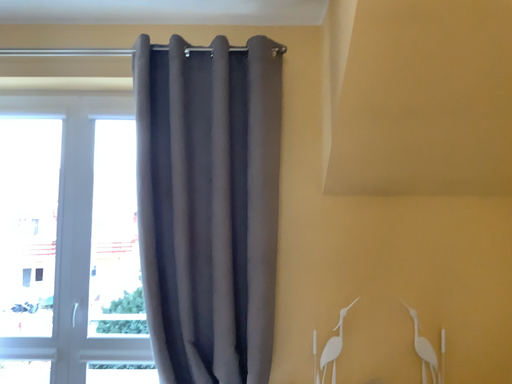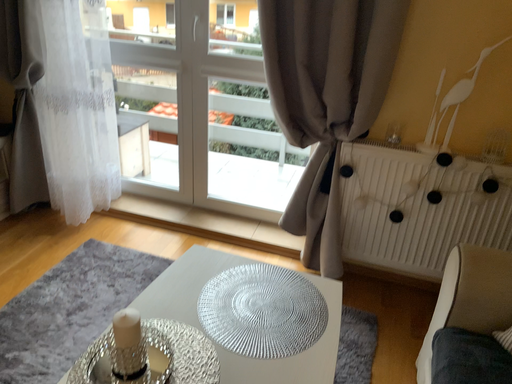
Question: How did the camera likely rotate when shooting the video?

Choices:
 (A) rotated right
 (B) rotated left

Answer: (B)